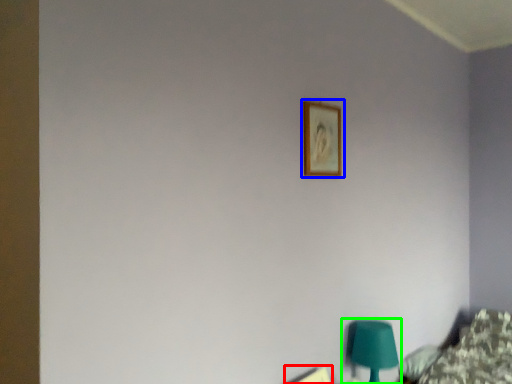
Question: Considering the real-world distances, which object is farthest from picture frame (highlighted by a red box)? picture frame (highlighted by a blue box) or table lamp (highlighted by a green box)?

Choices:
 (A) picture frame
 (B) table lamp

Answer: (A)